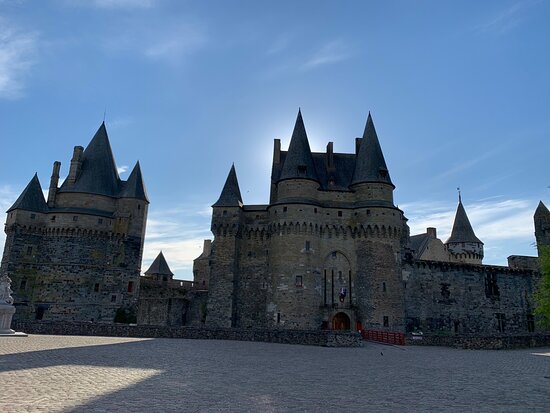
This screenshot has width=550, height=413. I want to click on wall brick, so (476, 340), (308, 340), (122, 326), (55, 326), (226, 336), (535, 338).